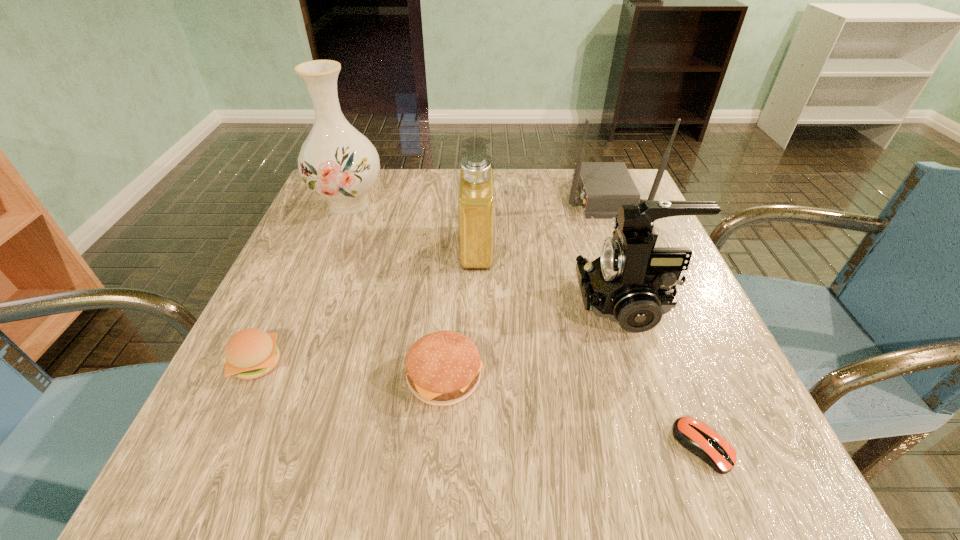
Identify the location of vacant space located 0.210m on the back of the router to connect cables. (478, 195).

The width and height of the screenshot is (960, 540). Identify the location of free space located on the back of the router to connect cables. (535, 195).

This screenshot has height=540, width=960. Identify the location of free space located 0.060m on the back of the router to connect cables. (539, 195).

Where is `blank space located on the lens mount of the camcorder`? blank space located on the lens mount of the camcorder is located at coordinates (449, 302).

Identify the location of vacant point located on the lens mount of the camcorder. This screenshot has width=960, height=540. (536, 302).

Where is `vacant space positioned on the lens mount of the camcorder`? Image resolution: width=960 pixels, height=540 pixels. vacant space positioned on the lens mount of the camcorder is located at coordinates (400, 302).

At what (x,y) coordinates should I click in order to perform the action: click on vacant space located on the left of the right hamburger. Please return your answer as a coordinate pair (x, y). Looking at the image, I should click on (254, 377).

Image resolution: width=960 pixels, height=540 pixels. What are the coordinates of `free space located on the right of the left hamburger` in the screenshot? It's located at (532, 363).

Locate an element on the screen. The image size is (960, 540). vacant space located on the back of the computer mouse is located at coordinates (636, 274).

At what (x,y) coordinates should I click in order to perform the action: click on vase located in the far edge section of the desktop. Please return your answer as a coordinate pair (x, y). Looking at the image, I should click on (337, 162).